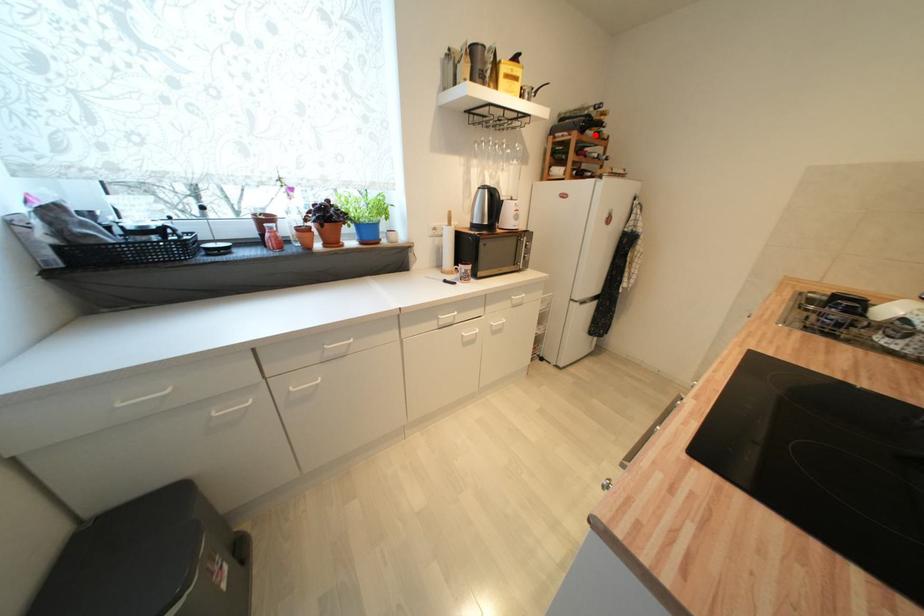
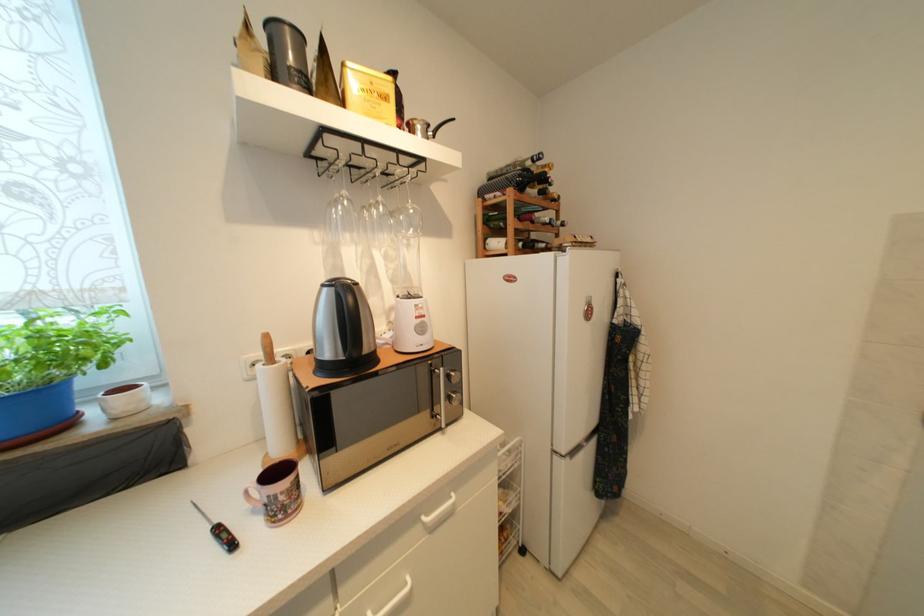
In the second image, find the point that corresponds to the highlighted location in the first image.

(538, 193)